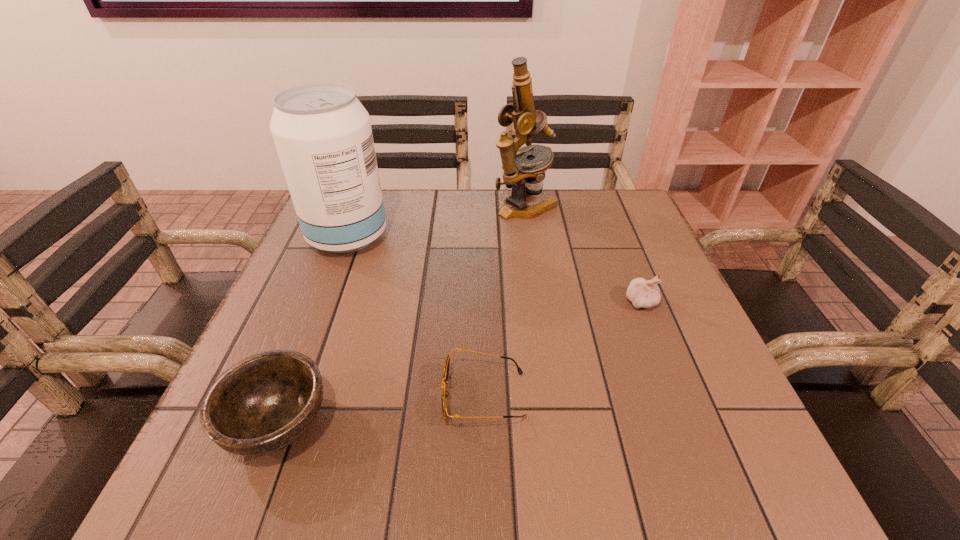
The width and height of the screenshot is (960, 540). In order to click on microscope in this screenshot , I will do `click(524, 176)`.

Where is `alcohol`? The width and height of the screenshot is (960, 540). alcohol is located at coordinates (322, 133).

Find the location of a particular element. garlic is located at coordinates (643, 294).

The width and height of the screenshot is (960, 540). I want to click on the third farthest object, so click(x=643, y=294).

This screenshot has height=540, width=960. Find the location of `bowl`. bowl is located at coordinates (262, 404).

Locate an element on the screen. This screenshot has width=960, height=540. sunglasses is located at coordinates click(445, 394).

Identify the location of vacant point located 0.050m on the front of the microscope. The height and width of the screenshot is (540, 960). (530, 234).

The width and height of the screenshot is (960, 540). I want to click on free location located on the back of the alcohol, so click(366, 190).

You are a GUI agent. You are given a task and a screenshot of the screen. Output one action in this format:
    pyautogui.click(x=<x>, y=<y>)
    Task: Click on the free region located on the left of the rightmost object
    This screenshot has width=960, height=540.
    Given the screenshot: What is the action you would take?
    pyautogui.click(x=452, y=302)

Locate an element on the screen. This screenshot has height=540, width=960. vacant area situated on the back of the bowl is located at coordinates (344, 251).